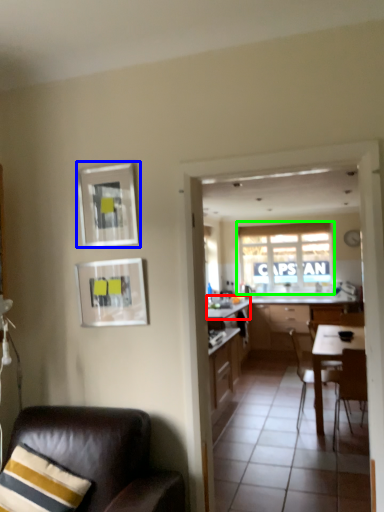
Question: Which object is the farthest from counter top (highlighted by a red box)? Choose among these: picture frame (highlighted by a blue box) or window (highlighted by a green box).

Choices:
 (A) picture frame
 (B) window

Answer: (A)